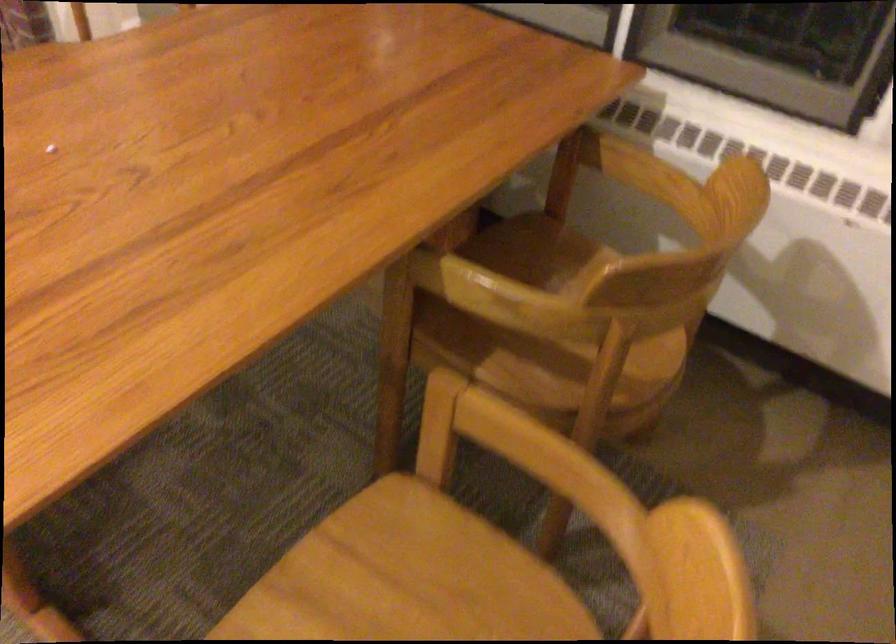
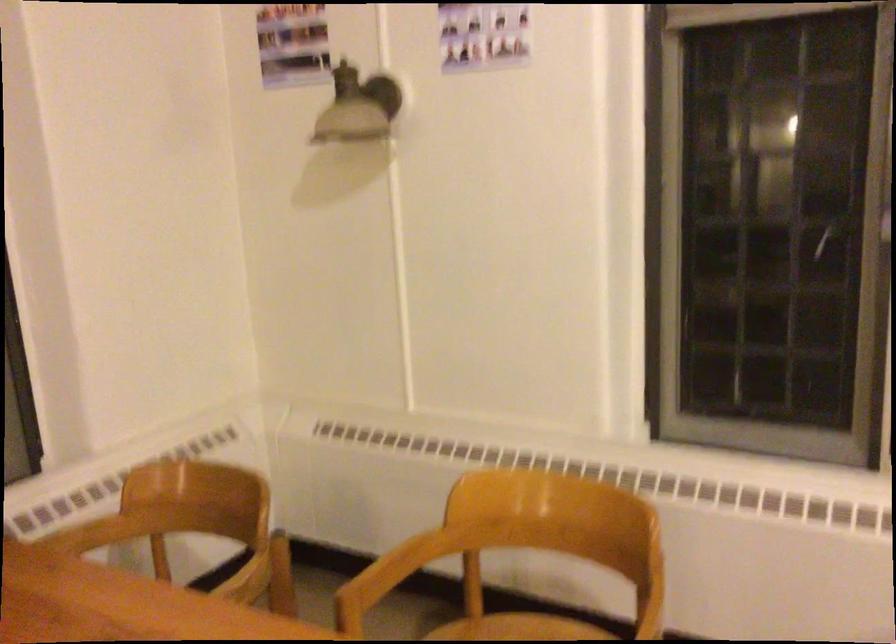
Find the pixel in the second image that matches point 513,450 in the first image.

(389, 574)